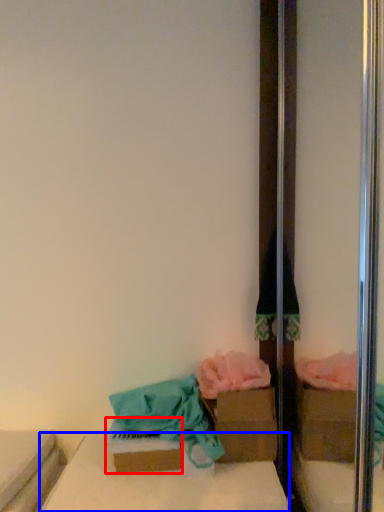
Question: Which object is further to the camera taking this photo, cardboard box (highlighted by a red box) or furniture (highlighted by a blue box)?

Choices:
 (A) cardboard box
 (B) furniture

Answer: (A)